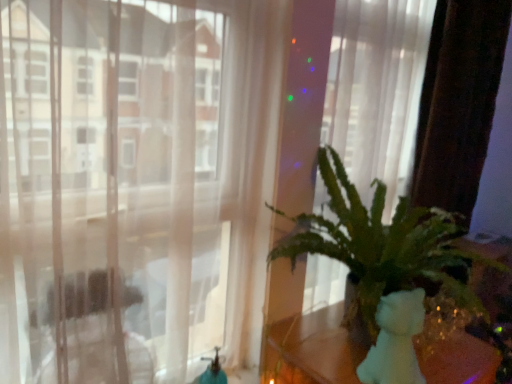
Question: Is transparent curtain at center inside or outside of green leafy plant at right?

Choices:
 (A) outside
 (B) inside

Answer: (A)

Question: From the image's perspective, relative to green leafy plant at right, is transparent curtain at center above or below?

Choices:
 (A) below
 (B) above

Answer: (B)

Question: Estimate the real-world distances between objects in this image. Which object is closer to the transparent curtain at center?

Choices:
 (A) white matte teddy bear at right
 (B) green leafy plant at right

Answer: (B)

Question: Estimate the real-world distances between objects in this image. Which object is closer to the green leafy plant at right?

Choices:
 (A) transparent curtain at center
 (B) white matte teddy bear at right

Answer: (B)